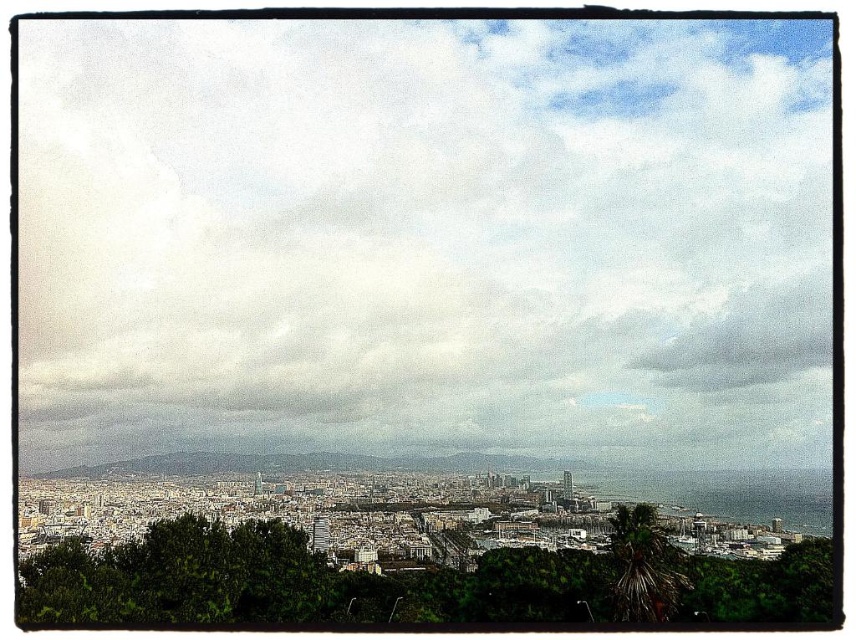
From the picture: Measure the distance between green leafy tree at center and camera.

They are 653.18 meters apart.

Is point (545, 621) positioned before point (622, 566)?

That is True.

Where is `green leafy tree at center`? The height and width of the screenshot is (640, 856). green leafy tree at center is located at coordinates (413, 580).

Is cloudy sky at upper center to the right of green leafy tree at center from the viewer's perspective?

Indeed, cloudy sky at upper center is positioned on the right side of green leafy tree at center.

Find the location of a particular element. The height and width of the screenshot is (640, 856). cloudy sky at upper center is located at coordinates (426, 240).

Which is in front, point (739, 156) or point (560, 612)?

Point (560, 612)

Identify the location of cloudy sky at upper center. (426, 240).

Which is more to the right, cloudy sky at upper center or green leafy palm at lower right?

green leafy palm at lower right is more to the right.

Who is taller, cloudy sky at upper center or green leafy palm at lower right?

With more height is cloudy sky at upper center.

Identify the location of cloudy sky at upper center. (426, 240).